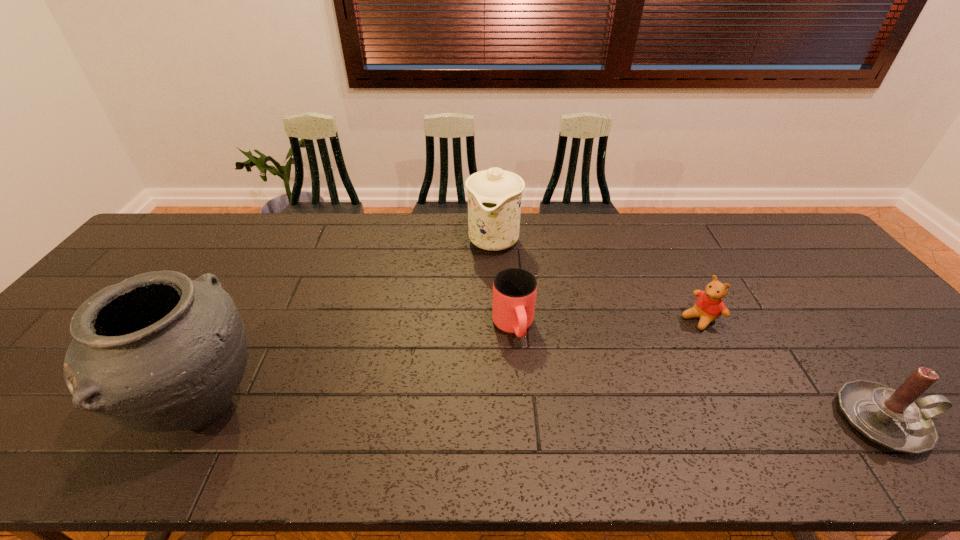
Locate an element on the screen. The height and width of the screenshot is (540, 960). vacant space situated 0.190m on the spout of the chinaware is located at coordinates coord(477,305).

Find the location of `free location located 0.320m on the spout of the chinaware`. free location located 0.320m on the spout of the chinaware is located at coordinates (467, 340).

Identify the location of free location located on the spout of the chinaware. 480,296.

The height and width of the screenshot is (540, 960). Identify the location of vacant point located 0.290m on the front-facing side of the teddy bear. (608, 373).

You are a GUI agent. You are given a task and a screenshot of the screen. Output one action in this format:
    pyautogui.click(x=<x>, y=<y>)
    Task: Click on the free space located 0.050m on the front-facing side of the teddy bear
    The width and height of the screenshot is (960, 540).
    Given the screenshot: What is the action you would take?
    pyautogui.click(x=675, y=333)

You are a GUI agent. You are given a task and a screenshot of the screen. Output one action in this format:
    pyautogui.click(x=<x>, y=<y>)
    Task: Click on the free space located on the front-facing side of the teddy bear
    
    Given the screenshot: What is the action you would take?
    pyautogui.click(x=664, y=339)

Where is `object located at the far edge`? The width and height of the screenshot is (960, 540). object located at the far edge is located at coordinates (494, 196).

Locate an element on the screen. The width and height of the screenshot is (960, 540). object that is positioned at the near edge is located at coordinates 158,352.

Locate an element on the screen. free region at the far edge is located at coordinates (301, 251).

In the image, there is a desktop. At what (x,y) coordinates should I click in order to perform the action: click on free space at the near edge. Please return your answer as a coordinate pair (x, y). Looking at the image, I should click on (276, 407).